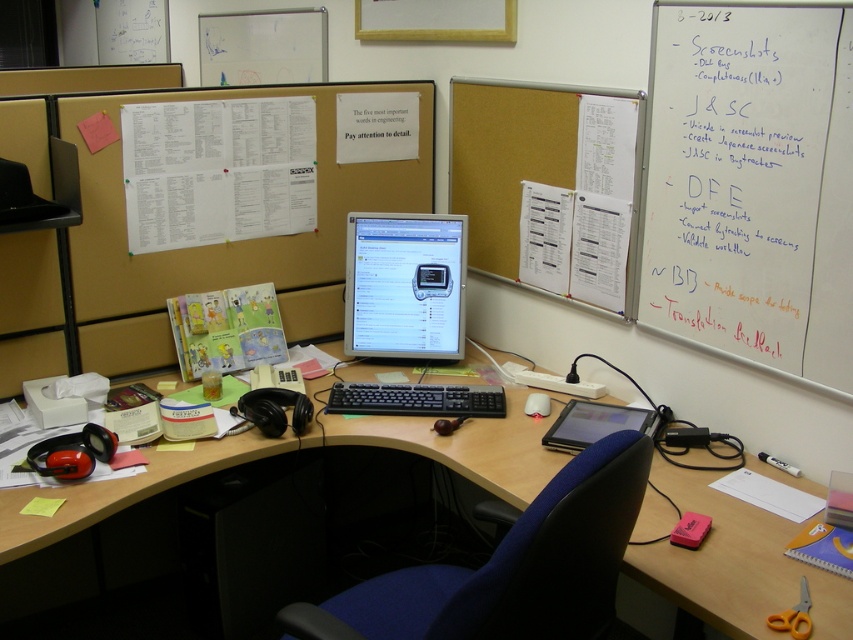
Is whiteboard at upper right positioned before matte plastic monitor at center?

Yes, whiteboard at upper right is closer to the viewer.

Does whiteboard at upper right have a greater height compared to matte plastic monitor at center?

Yes, whiteboard at upper right is taller than matte plastic monitor at center.

Is point (666, 189) closer to camera compared to point (397, 246)?

Yes, it is.

Where is `whiteboard at upper right`? This screenshot has height=640, width=853. whiteboard at upper right is located at coordinates (751, 182).

Does matte black monitor at center have a lesser width compared to black plastic keyboard at center?

No, matte black monitor at center is not thinner than black plastic keyboard at center.

Which is behind, point (844, 620) or point (338, 388)?

The point (338, 388) is behind.

What are the coordinates of `matte black monitor at center` in the screenshot? It's located at (735, 564).

Which of these two, whiteboard at upper right or matte black monitor at center, stands shorter?

matte black monitor at center is shorter.

Describe the element at coordinates (751, 182) in the screenshot. This screenshot has height=640, width=853. I see `whiteboard at upper right` at that location.

The image size is (853, 640). What are the coordinates of `whiteboard at upper right` in the screenshot? It's located at (751, 182).